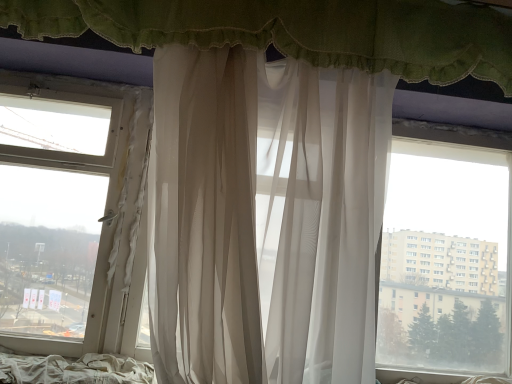
This screenshot has width=512, height=384. Describe the element at coordinates (73, 370) in the screenshot. I see `white fabric bed at lower left` at that location.

From the picture: In order to face sheer white curtain at center, marked as the 2th curtain in a top-to-bottom arrangement, should I rotate leftwards or rightwards?

To face it directly, rotate right by 2.167 degrees.

The height and width of the screenshot is (384, 512). What do you see at coordinates (297, 31) in the screenshot?
I see `sheer white curtain at upper center, acting as the 2th curtain starting from the bottom` at bounding box center [297, 31].

You are a GUI agent. You are given a task and a screenshot of the screen. Output one action in this format:
    pyautogui.click(x=<x>, y=<y>)
    Task: Click on the sheer white curtain at upper center, acting as the 2th curtain starting from the bottom
    
    Given the screenshot: What is the action you would take?
    pyautogui.click(x=297, y=31)

Locate an element on the screen. The height and width of the screenshot is (384, 512). white fabric bed at lower left is located at coordinates (73, 370).

Is white fabric bed at lower left outside of sheer white curtain at upper center, arranged as the 1th curtain when viewed from the top?

Yes.

Based on the photo, from a real-world perspective, which is physically above, white fabric bed at lower left or sheer white curtain at upper center, acting as the 2th curtain starting from the bottom?

sheer white curtain at upper center, acting as the 2th curtain starting from the bottom.

Where is `the 2nd curtain directly above the white fabric bed at lower left (from a real-world perspective)`? the 2nd curtain directly above the white fabric bed at lower left (from a real-world perspective) is located at coordinates click(297, 31).

How far apart are white fabric bed at lower left and sheer white curtain at upper center, arranged as the 1th curtain when viewed from the top?

They are 1.23 meters apart.

Are sheer white curtain at center, the first curtain ordered from the bottom, and sheer white curtain at upper center, acting as the 2th curtain starting from the bottom, beside each other?

They are not placed beside each other.

Considering the sizes of objects sheer white curtain at center, marked as the 2th curtain in a top-to-bottom arrangement, and sheer white curtain at upper center, arranged as the 1th curtain when viewed from the top, in the image provided, who is wider, sheer white curtain at center, marked as the 2th curtain in a top-to-bottom arrangement, or sheer white curtain at upper center, arranged as the 1th curtain when viewed from the top,?

With larger width is sheer white curtain at center, marked as the 2th curtain in a top-to-bottom arrangement.

Between sheer white curtain at center, the first curtain ordered from the bottom, and sheer white curtain at upper center, arranged as the 1th curtain when viewed from the top, which one appears on the left side from the viewer's perspective?

From the viewer's perspective, sheer white curtain at center, the first curtain ordered from the bottom, appears more on the left side.

Which is in front, sheer white curtain at center, the first curtain ordered from the bottom, or sheer white curtain at upper center, arranged as the 1th curtain when viewed from the top?

Positioned in front is sheer white curtain at center, the first curtain ordered from the bottom.

From the image's perspective, is sheer white curtain at upper center, arranged as the 1th curtain when viewed from the top, above or below white fabric bed at lower left?

sheer white curtain at upper center, arranged as the 1th curtain when viewed from the top, is situated higher than white fabric bed at lower left in the image.

Is sheer white curtain at upper center, acting as the 2th curtain starting from the bottom, looking in the opposite direction of white fabric bed at lower left?

No, sheer white curtain at upper center, acting as the 2th curtain starting from the bottom, is not facing away from white fabric bed at lower left.

Between sheer white curtain at upper center, acting as the 2th curtain starting from the bottom, and white fabric bed at lower left, which one appears on the right side from the viewer's perspective?

From the viewer's perspective, sheer white curtain at upper center, acting as the 2th curtain starting from the bottom, appears more on the right side.

Which curtain is the 2nd one when counting from the right side of the white fabric bed at lower left? Please provide its 2D coordinates.

[(297, 31)]

From the white fabric bed at lower left, count 2nd curtains forward and point to it. Please provide its 2D coordinates.

[(264, 218)]

Could you tell me if sheer white curtain at center, marked as the 2th curtain in a top-to-bottom arrangement, is turned towards white fabric bed at lower left?

No, sheer white curtain at center, marked as the 2th curtain in a top-to-bottom arrangement, is not aimed at white fabric bed at lower left.

From their relative heights in the image, would you say sheer white curtain at center, the first curtain ordered from the bottom, is taller or shorter than white fabric bed at lower left?

Considering their sizes, sheer white curtain at center, the first curtain ordered from the bottom, has more height than white fabric bed at lower left.

What's the angular difference between sheer white curtain at center, the first curtain ordered from the bottom, and white fabric bed at lower left's facing directions?

There is a 0.000188-degree angle between the facing directions of sheer white curtain at center, the first curtain ordered from the bottom, and white fabric bed at lower left.

Between white fabric bed at lower left and sheer white curtain at center, marked as the 2th curtain in a top-to-bottom arrangement, which one has larger width?

sheer white curtain at center, marked as the 2th curtain in a top-to-bottom arrangement.

Based on the photo, is sheer white curtain at center, the first curtain ordered from the bottom, a part of white fabric bed at lower left?

That's incorrect, sheer white curtain at center, the first curtain ordered from the bottom, is not inside white fabric bed at lower left.

From the image's perspective, which is below, white fabric bed at lower left or sheer white curtain at center, the first curtain ordered from the bottom?

white fabric bed at lower left, from the image's perspective.

From a real-world perspective, between sheer white curtain at upper center, acting as the 2th curtain starting from the bottom, and sheer white curtain at center, the first curtain ordered from the bottom, who is vertically higher?

sheer white curtain at upper center, acting as the 2th curtain starting from the bottom, is physically above.

Considering the sizes of sheer white curtain at upper center, acting as the 2th curtain starting from the bottom, and sheer white curtain at center, marked as the 2th curtain in a top-to-bottom arrangement, in the image, is sheer white curtain at upper center, acting as the 2th curtain starting from the bottom, wider or thinner than sheer white curtain at center, marked as the 2th curtain in a top-to-bottom arrangement,?

Considering their sizes, sheer white curtain at upper center, acting as the 2th curtain starting from the bottom, looks slimmer than sheer white curtain at center, marked as the 2th curtain in a top-to-bottom arrangement.

Is sheer white curtain at upper center, arranged as the 1th curtain when viewed from the top, spatially inside sheer white curtain at center, marked as the 2th curtain in a top-to-bottom arrangement, or outside of it?

sheer white curtain at upper center, arranged as the 1th curtain when viewed from the top, is spatially situated outside sheer white curtain at center, marked as the 2th curtain in a top-to-bottom arrangement.

Based on the photo, in terms of height, does sheer white curtain at upper center, acting as the 2th curtain starting from the bottom, look taller or shorter compared to sheer white curtain at center, the first curtain ordered from the bottom?

In the image, sheer white curtain at upper center, acting as the 2th curtain starting from the bottom, appears to be shorter than sheer white curtain at center, the first curtain ordered from the bottom.

From the image's perspective, starting from the white fabric bed at lower left, which curtain is the 2nd one above? Please provide its 2D coordinates.

[(297, 31)]

The width and height of the screenshot is (512, 384). What are the coordinates of `curtain in front of the sheer white curtain at upper center, acting as the 2th curtain starting from the bottom` in the screenshot? It's located at (264, 218).

Which object lies further to the anchor point sheer white curtain at center, the first curtain ordered from the bottom, white fabric bed at lower left or sheer white curtain at upper center, arranged as the 1th curtain when viewed from the top?

white fabric bed at lower left.

Which object lies nearer to the anchor point sheer white curtain at upper center, acting as the 2th curtain starting from the bottom, white fabric bed at lower left or sheer white curtain at center, the first curtain ordered from the bottom?

sheer white curtain at center, the first curtain ordered from the bottom, is closer to sheer white curtain at upper center, acting as the 2th curtain starting from the bottom.

Which object lies further to the anchor point white fabric bed at lower left, sheer white curtain at center, marked as the 2th curtain in a top-to-bottom arrangement, or sheer white curtain at upper center, acting as the 2th curtain starting from the bottom?

sheer white curtain at upper center, acting as the 2th curtain starting from the bottom, lies further to white fabric bed at lower left than the other object.

When comparing their distances from sheer white curtain at center, the first curtain ordered from the bottom, does sheer white curtain at upper center, arranged as the 1th curtain when viewed from the top, or white fabric bed at lower left seem closer?

sheer white curtain at upper center, arranged as the 1th curtain when viewed from the top, is closer to sheer white curtain at center, the first curtain ordered from the bottom.

Looking at the image, which one is located further to white fabric bed at lower left, sheer white curtain at upper center, arranged as the 1th curtain when viewed from the top, or sheer white curtain at center, the first curtain ordered from the bottom?

sheer white curtain at upper center, arranged as the 1th curtain when viewed from the top, is further to white fabric bed at lower left.

When comparing their distances from sheer white curtain at upper center, arranged as the 1th curtain when viewed from the top, does sheer white curtain at center, marked as the 2th curtain in a top-to-bottom arrangement, or white fabric bed at lower left seem closer?

The object closer to sheer white curtain at upper center, arranged as the 1th curtain when viewed from the top, is sheer white curtain at center, marked as the 2th curtain in a top-to-bottom arrangement.

Image resolution: width=512 pixels, height=384 pixels. What are the coordinates of `curtain that lies between sheer white curtain at upper center, acting as the 2th curtain starting from the bottom, and white fabric bed at lower left from top to bottom` in the screenshot? It's located at (264, 218).